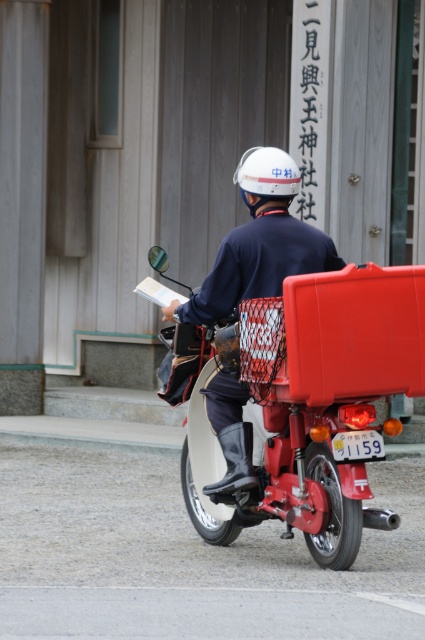
You are a pedestrian standing on the sidewalk and see the matte white helmet at upper center and the white matte helmet at center. Which one is closer to you?

The matte white helmet at upper center is closer to the viewer than the white matte helmet at center.

You are standing at the origin point of the image coordinate system. You see two points, point (277,208) and point (238,166). Which point is closer to you?

Point (277,208) is in front of point (238,166), so it is closer to you.